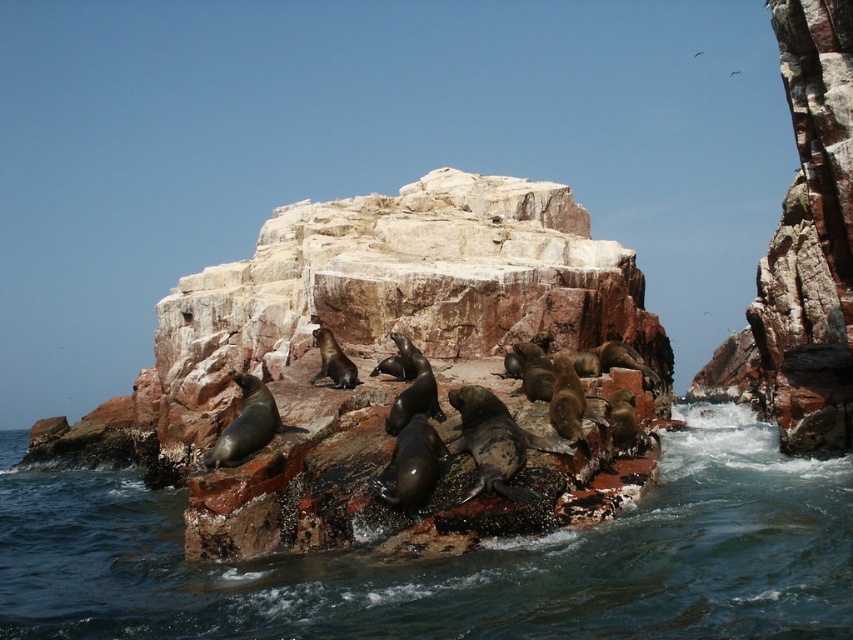
You are a marine biologist observing the coastal scene. You need to place a monitoring device on the smaller of the two rocks. Which rock should you choose between the rustic stone rock at center and the rusty rock at upper right?

The rustic stone rock at center is smaller than the rusty rock at upper right, so you should place the monitoring device on the rustic stone rock at center.

You are a marine biologist observing the coastal scene. You need to place a 1.5 meter wide measurement tool between the rustic stone rock at center and the smooth rock water at center. Based on their widths, will the tool fit entirely between them?

The rustic stone rock at center has a lesser width compared to smooth rock water at center. Since the tool is 1.5 meters wide and the smooth rock water at center is wider, the tool should fit between them as long as the combined width of both rocks allows for the tool to be placed without overlapping.

You are standing on the rocky outcrop and want to reach the smooth rock water at center. Which direction should you move to get there from your current position at point [456,561]?

The point [456,561] is already on the smooth rock water at center, so you don not need to move in any direction.